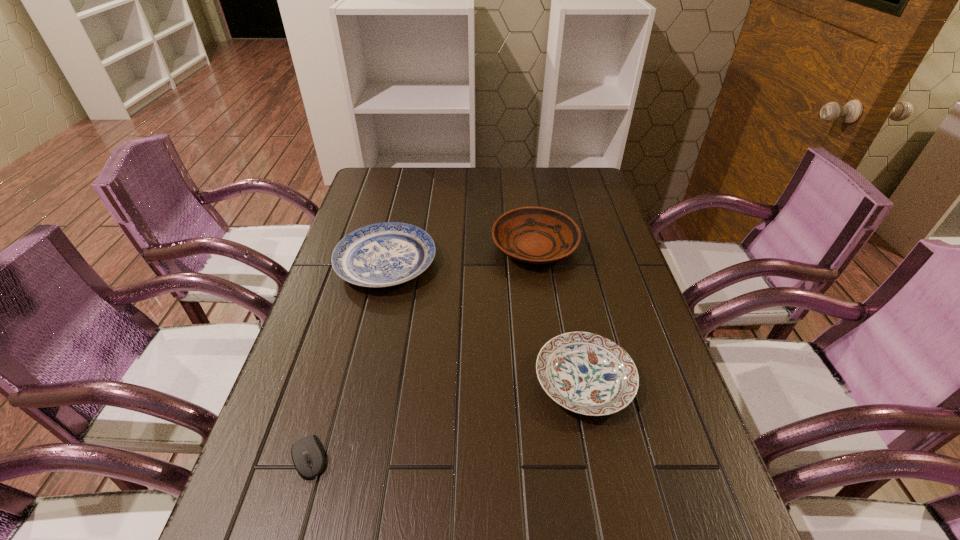
You are a GUI agent. You are given a task and a screenshot of the screen. Output one action in this format:
    pyautogui.click(x=<x>, y=<y>)
    Task: Click on the free space between the tallest object and the leftmost plate
    The width and height of the screenshot is (960, 540).
    Given the screenshot: What is the action you would take?
    461,255

Find the location of a particular element. empty space that is in between the tallest object and the second nearest object is located at coordinates (560, 314).

What are the coordinates of `free point between the tallest plate and the computer equipment` in the screenshot? It's located at (422, 352).

Find the location of a particular element. vacant space in between the tallest plate and the nearest plate is located at coordinates (560, 314).

Locate an element on the screen. blank region between the tallest plate and the third farthest object is located at coordinates (560, 314).

Identify which object is located as the second nearest to the shortest object. Please provide its 2D coordinates. Your answer should be formatted as a tuple, i.e. [(x, y)], where the tuple contains the x and y coordinates of a point satisfying the conditions above.

[(586, 373)]

Identify the location of object that is the second closest to the tallest plate. (586, 373).

Identify the location of plate that is the second closest one to the tallest object. Image resolution: width=960 pixels, height=540 pixels. (586, 373).

Find the location of a particular element. This screenshot has height=540, width=960. plate object that ranks as the second closest to the leftmost plate is located at coordinates (x=586, y=373).

The image size is (960, 540). What are the coordinates of `vacant region that satisfies the following two spatial constraints: 1. on the back side of the tallest object; 2. on the right side of the nearest object` in the screenshot? It's located at (372, 247).